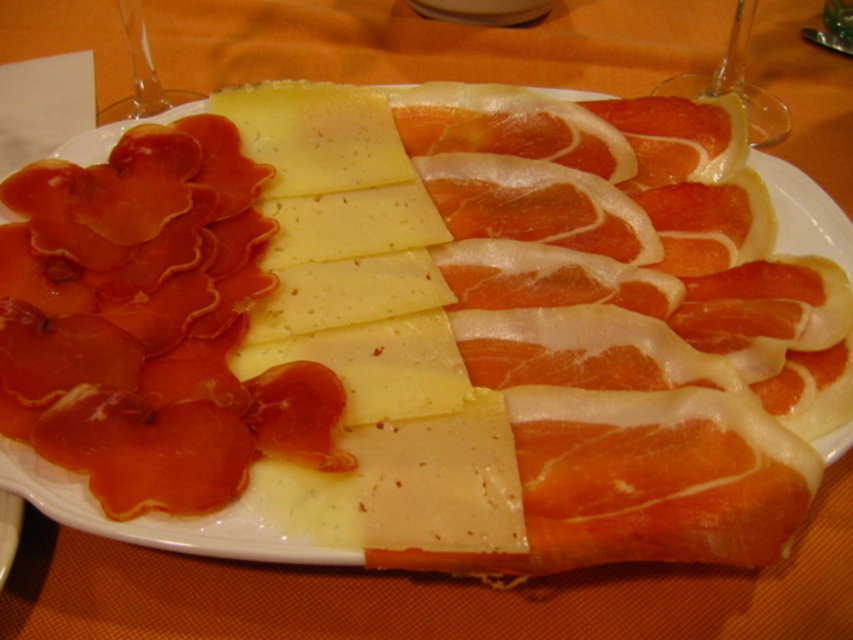
Based on the photo, which is below, yellow cheese at center or transparent glass at upper center?

yellow cheese at center

Locate an element on the screen. yellow cheese at center is located at coordinates (368, 332).

Who is lower down, transparent glass at upper center or transparent glass at upper left?

Positioned lower is transparent glass at upper center.

Does point (724, 60) come farther from viewer compared to point (122, 4)?

Yes, point (724, 60) is behind point (122, 4).

At what (x,y) coordinates should I click in order to perform the action: click on transparent glass at upper center. Please return your answer as a coordinate pair (x, y). Looking at the image, I should click on (735, 84).

Does yellow cheese at center have a larger size compared to transparent glass at upper left?

Yes.

Is point (326, 294) closer to viewer compared to point (103, 118)?

Yes, it is.

Identify the location of yellow cheese at center. This screenshot has height=640, width=853. (368, 332).